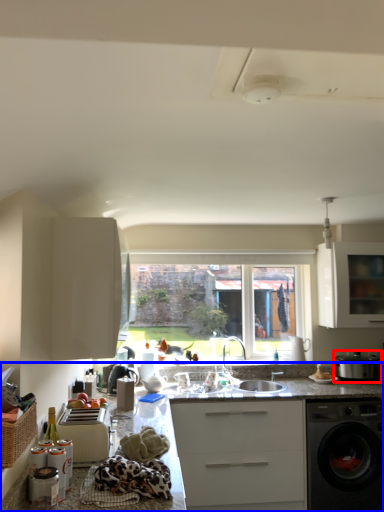
Question: Which point is closer to the camera, kitchen appliance (highlighted by a red box) or countertop (highlighted by a blue box)?

Choices:
 (A) kitchen appliance
 (B) countertop

Answer: (B)